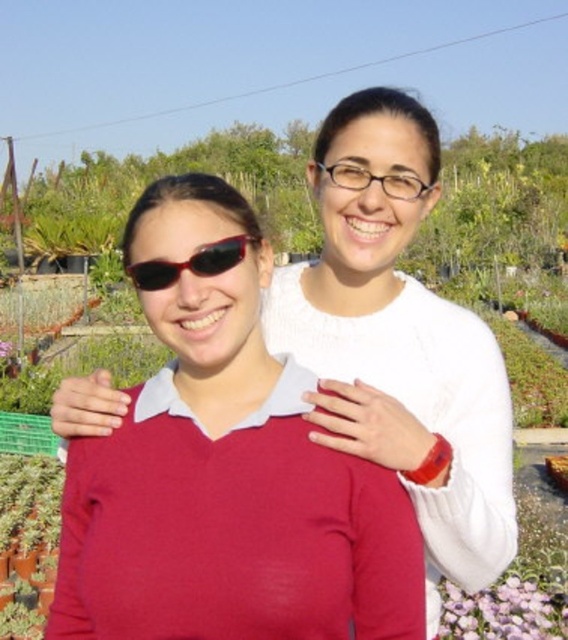
You are a customer at the garden center and want to ask the staff member about a plant. You notice the matte red sweater at center and the black plastic sunglasses at center. Which object is closer to your right side when facing the staff?

The matte red sweater at center is to the right of black plastic sunglasses at center, so when facing the staff member, the matte red sweater at center is closer to your right side.

You are taking a photo of the two people in the garden center. You want to focus on the person on the left first. Which of the two points, point (112, 605) or point (485, 614), should you adjust your camera focus to first?

Point (112, 605) is closer to the camera than point (485, 614). Therefore, you should focus on point (112, 605) first to ensure the person on the left is in clear focus before adjusting to the other point.

You are a photographer setting up a shoot at the garden center. You have a purple matte flower at lower right and black plastic sunglasses at center in your frame. Which object should you adjust to ensure both are fully visible in the photo?

The purple matte flower at lower right is much taller than the black plastic sunglasses at center, so you should lower the angle of the camera to include the entire flower without cropping it, while ensuring the sunglasses remain in frame.